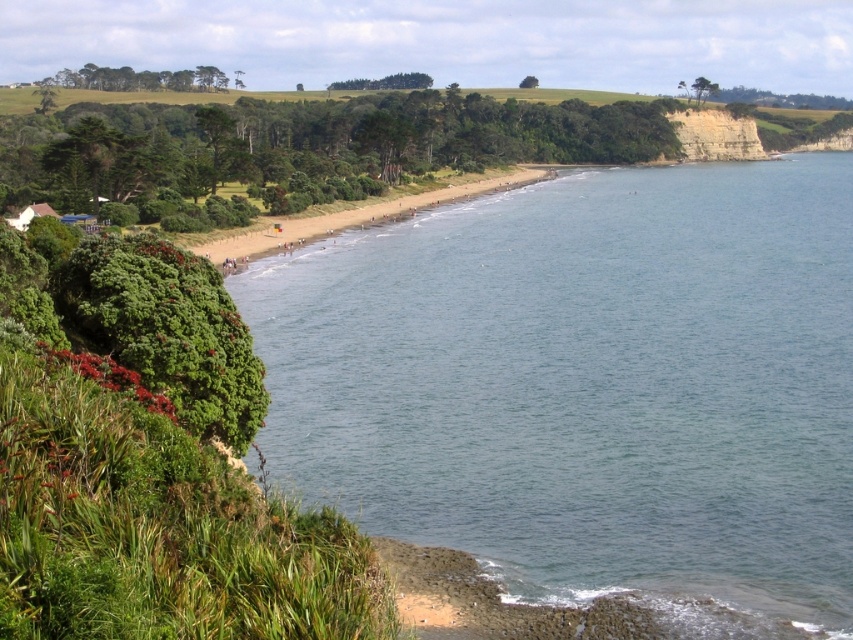
You are standing at the point with coordinates point [683,131] and want to walk to the point with coordinates point [532,499]. Which direction should you move relative to your current position?

You should move forward because point [532,499] is in front of point [683,131].

You are standing on the beach and want to take a photo of the clear blue water at center and the light beige sandstone cliff at upper right. Which object should you point your camera towards first if you want to capture both in one frame?

You should point your camera towards the clear blue water at center first because it is positioned under the light beige sandstone cliff at upper right, so capturing the lower area will include both objects in the frame.

In the scene shown: You are standing at the center of the beach and want to reach the clear blue water at center. Which direction should you walk to get there?

The clear blue water at center is located at point coordinates of 0.605 on the x axis and 0.692 on the y axis. Since you are at the center of the beach, you should walk towards the direction of the coordinates to reach the water.